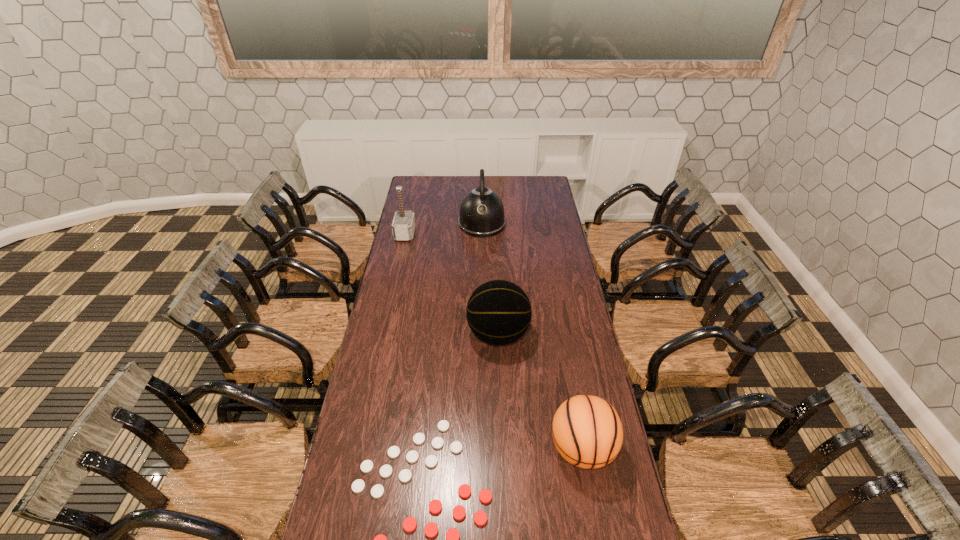
This screenshot has width=960, height=540. Identify the location of vacant space that is in between the right basketball and the kettle. (532, 336).

Select which object appears as the third closest to the kettle. Please provide its 2D coordinates. Your answer should be formatted as a tuple, i.e. [(x, y)], where the tuple contains the x and y coordinates of a point satisfying the conditions above.

[(485, 496)]

Choose which object is the nearest neighbor to the kettle. Please provide its 2D coordinates. Your answer should be formatted as a tuple, i.e. [(x, y)], where the tuple contains the x and y coordinates of a point satisfying the conditions above.

[(403, 226)]

Identify the location of vacant space that satisfies the following two spatial constraints: 1. on the spout of the farther basketball; 2. on the right side of the kettle. (483, 334).

Find the location of `free space that satisfies the following two spatial constraints: 1. on the spout of the kettle; 2. for striking with the head of the hammer`. free space that satisfies the following two spatial constraints: 1. on the spout of the kettle; 2. for striking with the head of the hammer is located at coordinates (482, 234).

Where is `vacant space that satisfies the following two spatial constraints: 1. on the spout of the rightmost object; 2. on the left side of the kettle`? vacant space that satisfies the following two spatial constraints: 1. on the spout of the rightmost object; 2. on the left side of the kettle is located at coordinates (483, 449).

Find the location of a particular element. vacant position in the image that satisfies the following two spatial constraints: 1. for striking with the head of the hammer; 2. on the left side of the rightmost object is located at coordinates (358, 449).

You are a GUI agent. You are given a task and a screenshot of the screen. Output one action in this format:
    pyautogui.click(x=<x>, y=<y>)
    Task: Click on the free space that satisfies the following two spatial constraints: 1. on the spout of the kettle; 2. for striking with the head of the hammer
    The height and width of the screenshot is (540, 960).
    Given the screenshot: What is the action you would take?
    pyautogui.click(x=482, y=234)

The height and width of the screenshot is (540, 960). In order to click on vacant space that satisfies the following two spatial constraints: 1. on the spout of the kettle; 2. on the left side of the shorter basketball in this screenshot , I will do `click(483, 449)`.

Where is `free point that satisfies the following two spatial constraints: 1. on the spout of the kettle; 2. on the left side of the nearer basketball`? This screenshot has height=540, width=960. free point that satisfies the following two spatial constraints: 1. on the spout of the kettle; 2. on the left side of the nearer basketball is located at coordinates [x=483, y=449].